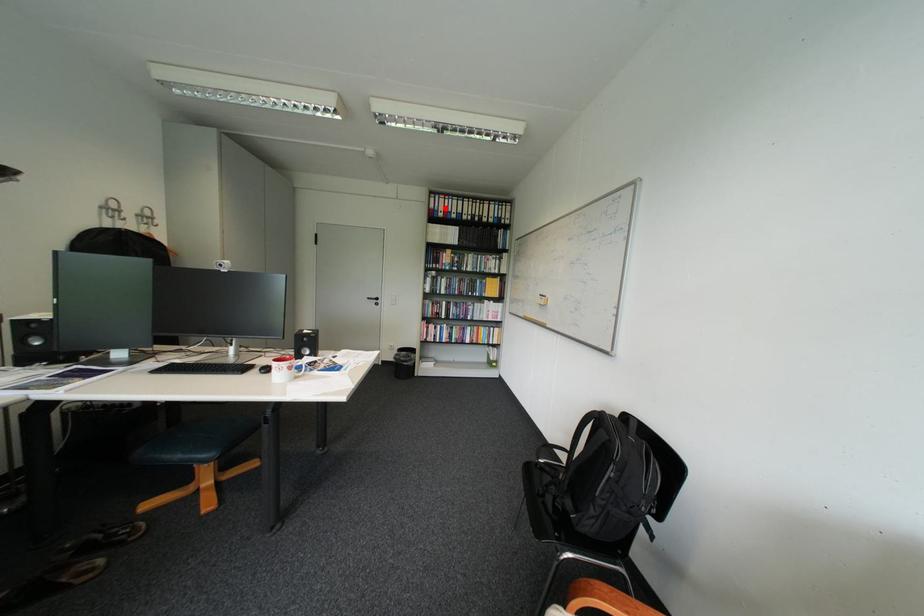
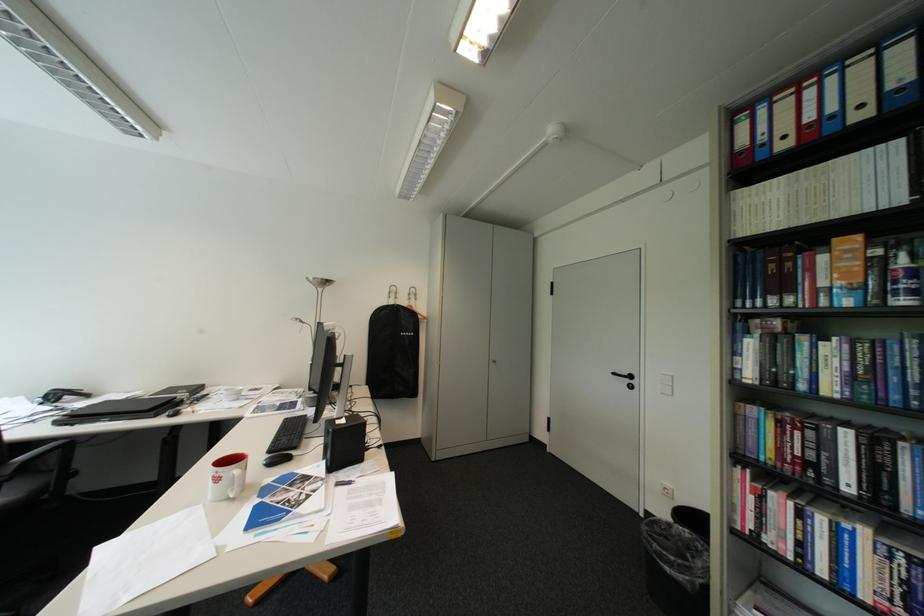
Question: I am providing you with two images of the same scene from different viewpoints. In image1, a red point is highlighted. Considering the same 3D point in image2, which of the following is correct?

Choices:
 (A) It is closer
 (B) It is farther

Answer: (B)